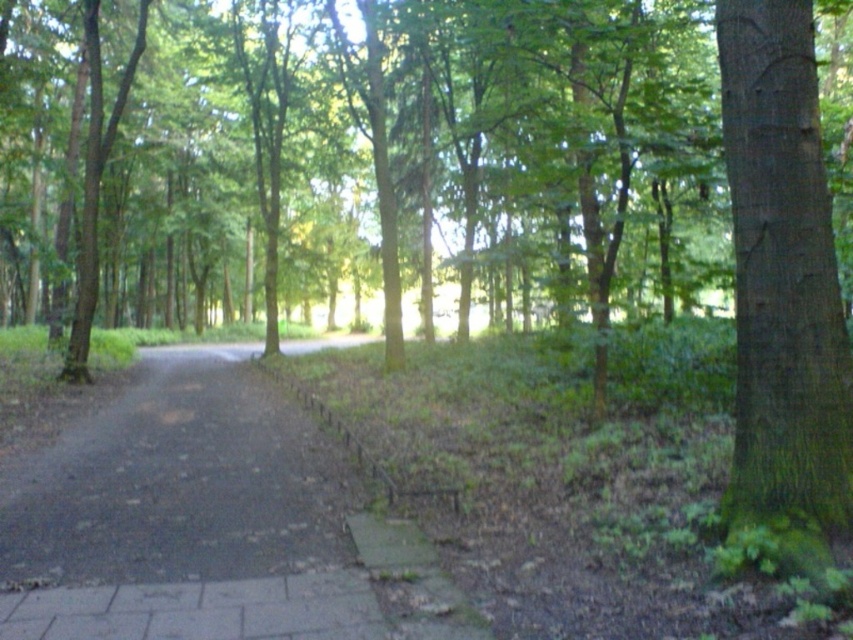
You are standing at the point labeled point (93, 456) in the forest scene. The path is 1.5 meters wide. Can you walk straight ahead without stepping off the path?

The point labeled point (93, 456) is 9.52 meters away from the viewer. Since the path is 1.5 meters wide, walking straight ahead would require staying within the path width. However, the distance between the point and the viewer doesn

You are a hiker who wants to stay dry during a sudden rain shower. Which object provides better shelter from the rain? The paved asphalt path at center or the green mossy bark tree at right?

The green mossy bark tree at right provides better shelter from the rain because it is positioned above the paved asphalt path at center, creating shade and protection from the rain.

In the scene shown: You are a hiker who wants to reach the green mossy bark tree at right from the paved asphalt path at center. Which direction should you head?

The paved asphalt path at center is to the left of the green mossy bark tree at right. To reach the green mossy bark tree at right, you should head to the right from the paved asphalt path at center.